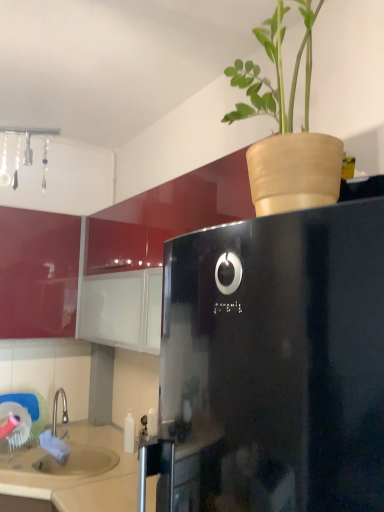
Question: Is beige matte sink at lower left in front of or behind glossy red cabinet at left in the image?

Choices:
 (A) front
 (B) behind

Answer: (A)

Question: From the image's perspective, is beige matte sink at lower left located above or below glossy red cabinet at left?

Choices:
 (A) above
 (B) below

Answer: (B)

Question: Which is correct: beige matte sink at lower left is inside glossy red cabinet at left, or outside of it?

Choices:
 (A) outside
 (B) inside

Answer: (A)

Question: Relative to beige matte sink at lower left, is glossy red cabinet at left in front or behind?

Choices:
 (A) behind
 (B) front

Answer: (A)

Question: Is glossy red cabinet at left wider or thinner than beige matte sink at lower left?

Choices:
 (A) thin
 (B) wide

Answer: (A)

Question: From the image's perspective, relative to beige matte sink at lower left, is glossy red cabinet at left above or below?

Choices:
 (A) above
 (B) below

Answer: (A)

Question: From a real-world perspective, relative to beige matte sink at lower left, is glossy red cabinet at left vertically above or below?

Choices:
 (A) above
 (B) below

Answer: (A)